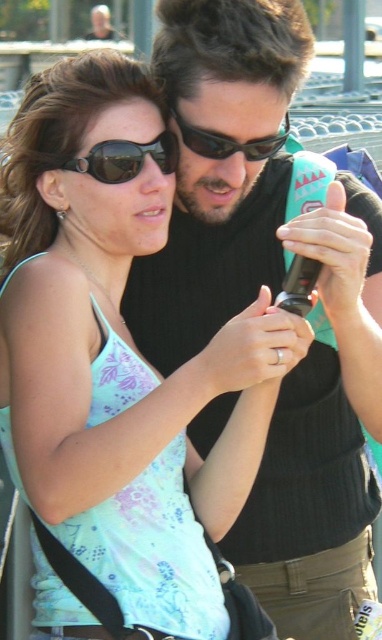
Who is lower down, matte black sunglasses at upper left or sunglasses at center?

Positioned lower is matte black sunglasses at upper left.

Consider the image. Measure the distance from matte black sunglasses at upper left to sunglasses at center.

matte black sunglasses at upper left is 32.55 centimeters from sunglasses at center.

The height and width of the screenshot is (640, 382). What do you see at coordinates (126, 157) in the screenshot?
I see `matte black sunglasses at upper left` at bounding box center [126, 157].

At what (x,y) coordinates should I click in order to perform the action: click on matte black sunglasses at upper left. Please return your answer as a coordinate pair (x, y). This screenshot has height=640, width=382. Looking at the image, I should click on (126, 157).